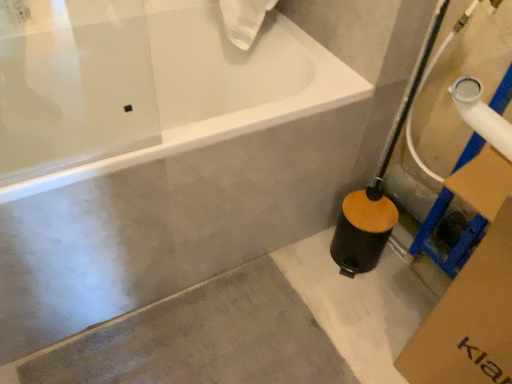
Question: Could you tell me if white glossy bathtub at upper center is turned towards gray concrete at lower left?

Choices:
 (A) no
 (B) yes

Answer: (B)

Question: Can you confirm if white glossy bathtub at upper center is thinner than gray concrete at lower left?

Choices:
 (A) no
 (B) yes

Answer: (A)

Question: Considering the relative sizes of white glossy bathtub at upper center and gray concrete at lower left in the image provided, is white glossy bathtub at upper center bigger than gray concrete at lower left?

Choices:
 (A) no
 (B) yes

Answer: (B)

Question: Does white glossy bathtub at upper center come behind gray concrete at lower left?

Choices:
 (A) yes
 (B) no

Answer: (B)

Question: From a real-world perspective, is white glossy bathtub at upper center over gray concrete at lower left?

Choices:
 (A) no
 (B) yes

Answer: (B)

Question: From a real-world perspective, is white glossy bathtub at upper center physically below gray concrete at lower left?

Choices:
 (A) no
 (B) yes

Answer: (A)

Question: Could you tell me if gray concrete at lower left is turned towards white glossy bathtub at upper center?

Choices:
 (A) no
 (B) yes

Answer: (A)

Question: Is gray concrete at lower left beside white glossy bathtub at upper center?

Choices:
 (A) no
 (B) yes

Answer: (A)

Question: Is gray concrete at lower left wider than white glossy bathtub at upper center?

Choices:
 (A) no
 (B) yes

Answer: (A)

Question: Considering the relative sizes of gray concrete at lower left and white glossy bathtub at upper center in the image provided, is gray concrete at lower left shorter than white glossy bathtub at upper center?

Choices:
 (A) yes
 (B) no

Answer: (A)

Question: Is gray concrete at lower left further to the viewer compared to white glossy bathtub at upper center?

Choices:
 (A) no
 (B) yes

Answer: (B)

Question: Considering the relative sizes of gray concrete at lower left and white glossy bathtub at upper center in the image provided, is gray concrete at lower left thinner than white glossy bathtub at upper center?

Choices:
 (A) no
 (B) yes

Answer: (B)

Question: Choose the correct answer: Is gray concrete at lower left inside white glossy bathtub at upper center or outside it?

Choices:
 (A) outside
 (B) inside

Answer: (A)